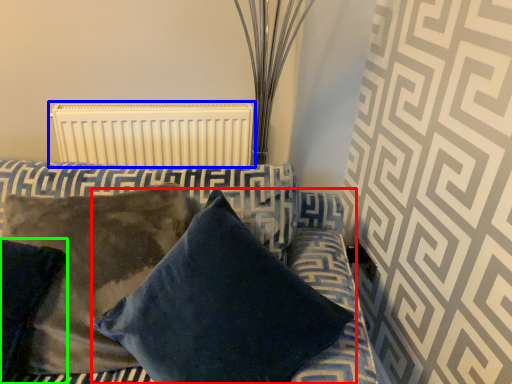
Question: Considering the real-world distances, which object is farthest from pillow (highlighted by a red box)? radiator (highlighted by a blue box) or pillow (highlighted by a green box)?

Choices:
 (A) radiator
 (B) pillow

Answer: (A)